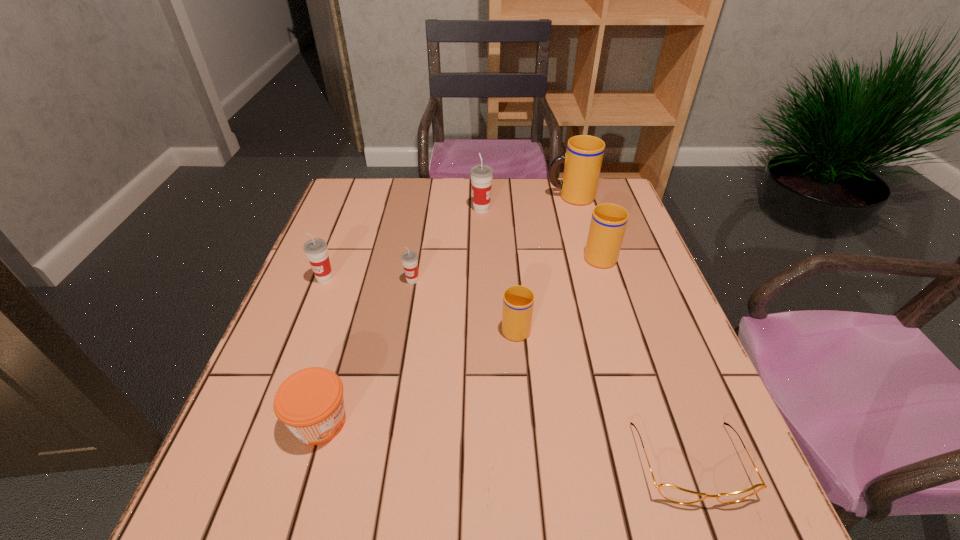
Find the location of a particular element. free space located 0.360m on the side of the leftmost object with the logo is located at coordinates (271, 419).

You are a GUI agent. You are given a task and a screenshot of the screen. Output one action in this format:
    pyautogui.click(x=<x>, y=<y>)
    Task: Click on the free spot located on the side of the second smallest beige cup with the handle
    This screenshot has height=540, width=960.
    Given the screenshot: What is the action you would take?
    pyautogui.click(x=582, y=201)

Find the location of a particular element. The image size is (960, 540). blank area located 0.210m on the side of the second smallest beige cup with the handle is located at coordinates pyautogui.click(x=582, y=199).

Image resolution: width=960 pixels, height=540 pixels. In order to click on vacant space located on the side of the second smallest beige cup with the handle in this screenshot , I will do `click(584, 205)`.

You are a GUI agent. You are given a task and a screenshot of the screen. Output one action in this format:
    pyautogui.click(x=<x>, y=<y>)
    Task: Click on the blank space located 0.050m on the side of the smallest beige cup with the handle
    Image resolution: width=960 pixels, height=540 pixels.
    Given the screenshot: What is the action you would take?
    pyautogui.click(x=514, y=296)

Where is `vacant point located on the side of the smallest beige cup with the handle`? vacant point located on the side of the smallest beige cup with the handle is located at coordinates (513, 293).

Find the location of a particular element. This screenshot has height=540, width=960. vacant space situated on the side of the smallest beige cup with the handle is located at coordinates (507, 218).

Image resolution: width=960 pixels, height=540 pixels. Identify the location of vacant region located 0.230m on the side of the third object from left to right with the logo. (399, 362).

Where is `vacant space located on the front label of the seventh object from right to left`? vacant space located on the front label of the seventh object from right to left is located at coordinates (439, 422).

Locate an element on the screen. The width and height of the screenshot is (960, 540). object that is at the near edge is located at coordinates (672, 493).